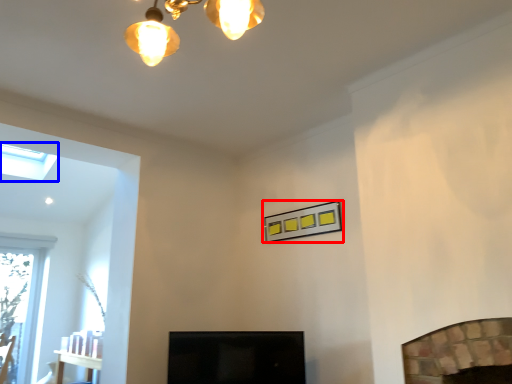
Question: Which object is further to the camera taking this photo, picture frame (highlighted by a red box) or lamp (highlighted by a blue box)?

Choices:
 (A) picture frame
 (B) lamp

Answer: (B)